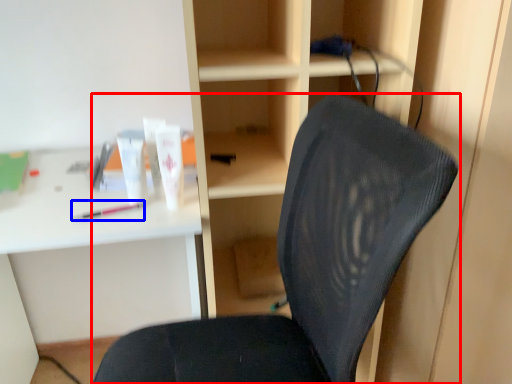
Question: Which object is closer to the camera taking this photo, chair (highlighted by a red box) or stationery (highlighted by a blue box)?

Choices:
 (A) chair
 (B) stationery

Answer: (A)